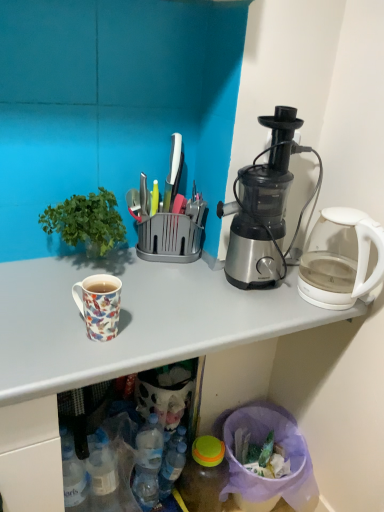
You are a GUI agent. You are given a task and a screenshot of the screen. Output one action in this format:
    pyautogui.click(x=<x>, y=<y>)
    Task: Click on the vacant area that lies between green leafy plant at left and satin silver blender at right
    
    Given the screenshot: What is the action you would take?
    pyautogui.click(x=170, y=282)